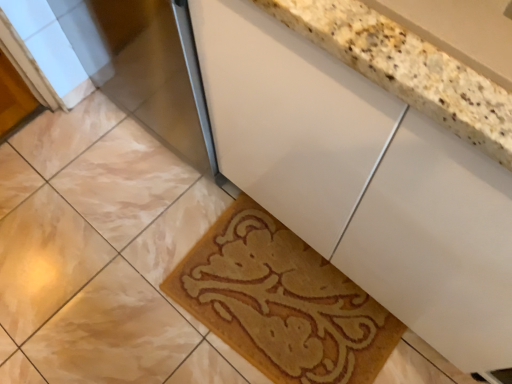
Where is `vacant area that is situated to the right of marble tile at lower left`? Image resolution: width=512 pixels, height=384 pixels. vacant area that is situated to the right of marble tile at lower left is located at coordinates (140, 239).